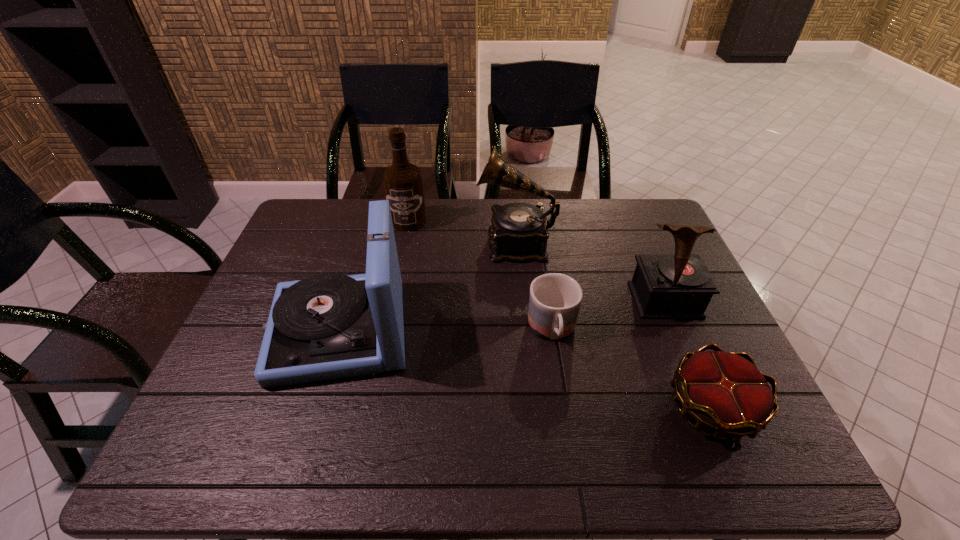
Where is `alcohol`? This screenshot has height=540, width=960. alcohol is located at coordinates (403, 183).

Find the location of a particular element. the farthest phonograph_record is located at coordinates (518, 233).

Where is `the leftmost phonograph_record`? Image resolution: width=960 pixels, height=540 pixels. the leftmost phonograph_record is located at coordinates (328, 326).

Image resolution: width=960 pixels, height=540 pixels. Identify the location of the rightmost phonograph_record. (664, 286).

Find the location of a particular element. mug is located at coordinates (554, 301).

Where is `crown`? The height and width of the screenshot is (540, 960). crown is located at coordinates (725, 392).

At what (x,y) coordinates should I click in order to perform the action: click on free space located on the label of the alcohol. Please return your answer as a coordinate pair (x, y). The height and width of the screenshot is (540, 960). Looking at the image, I should click on (390, 312).

This screenshot has width=960, height=540. Identify the location of vacant area located on the horn of the second phonograph_record from left to right. (408, 242).

Locate an element on the screen. This screenshot has height=540, width=960. vacant region located on the horn of the second phonograph_record from left to right is located at coordinates (390, 242).

Find the location of a particular element. free space located on the horn of the second phonograph_record from left to right is located at coordinates (399, 242).